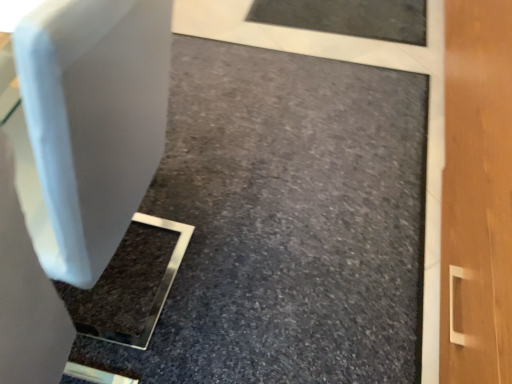
The height and width of the screenshot is (384, 512). In order to click on blank space above matte white concrete at center (from a real-world perspective) in this screenshot , I will do `click(278, 181)`.